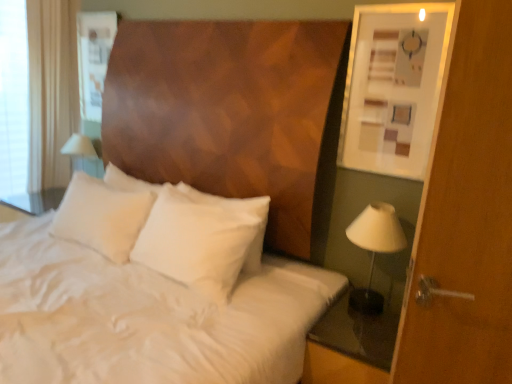
Locate an element on the screen. vacant area on top of transparent glass nightstand at lower right (from a real-world perspective) is located at coordinates (346, 324).